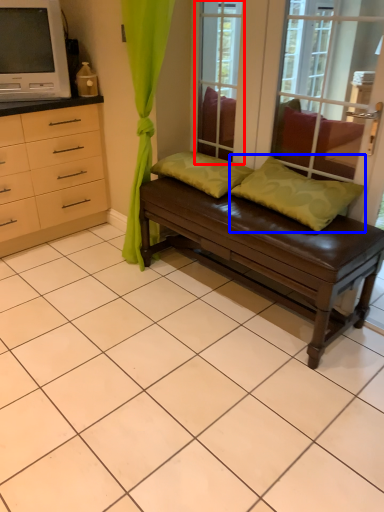
Question: Among these objects, which one is farthest to the camera, window screen (highlighted by a red box) or pillow (highlighted by a blue box)?

Choices:
 (A) window screen
 (B) pillow

Answer: (A)